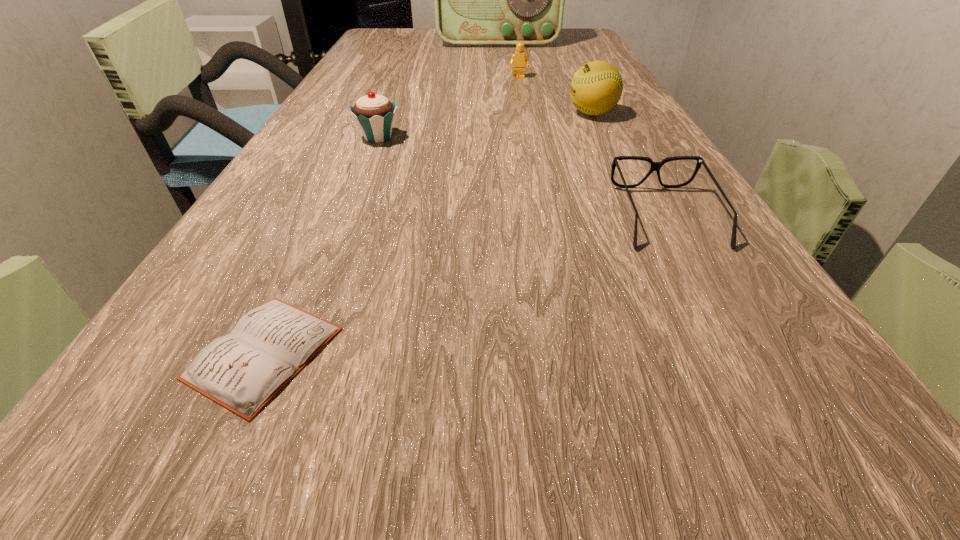
Where is `vacant point located on the logo side of the fourth nearest object`? The width and height of the screenshot is (960, 540). vacant point located on the logo side of the fourth nearest object is located at coordinates (484, 113).

In order to click on blank area located 0.130m on the logo side of the fourth nearest object in this screenshot , I will do `click(510, 113)`.

You are a GUI agent. You are given a task and a screenshot of the screen. Output one action in this format:
    pyautogui.click(x=<x>, y=<y>)
    Task: Click on the blank space located on the logo side of the fourth nearest object
    
    Given the screenshot: What is the action you would take?
    pyautogui.click(x=510, y=113)

I want to click on free location located on the right of the cupcake, so click(503, 137).

Where is `vacant space situated 0.380m on the face of the fifth nearest object`? Image resolution: width=960 pixels, height=540 pixels. vacant space situated 0.380m on the face of the fifth nearest object is located at coordinates (532, 144).

Where is `free space located 0.130m with the lenses facing outward on the fifth tallest object`? free space located 0.130m with the lenses facing outward on the fifth tallest object is located at coordinates (721, 319).

You are a GUI agent. You are given a task and a screenshot of the screen. Output one action in this format:
    pyautogui.click(x=<x>, y=<y>)
    Task: Click on the free region located 0.060m on the back of the shortest object
    
    Given the screenshot: What is the action you would take?
    pyautogui.click(x=302, y=268)

Image resolution: width=960 pixels, height=540 pixels. In order to click on object that is at the far edge in this screenshot , I will do `click(479, 0)`.

Find the location of a particular element. This screenshot has height=540, width=960. cupcake that is at the left edge is located at coordinates (374, 114).

Image resolution: width=960 pixels, height=540 pixels. What are the coordinates of `diary that is at the left edge` in the screenshot? It's located at 241,371.